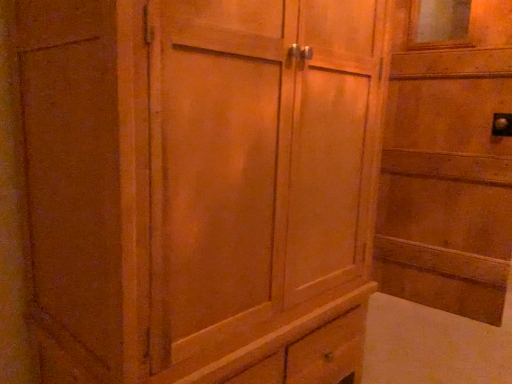
Question: Are wooden cabinet at center and wooden door at right making contact?

Choices:
 (A) no
 (B) yes

Answer: (A)

Question: Is wooden cabinet at center positioned with its back to wooden door at right?

Choices:
 (A) yes
 (B) no

Answer: (B)

Question: Is wooden cabinet at center positioned in front of wooden door at right?

Choices:
 (A) yes
 (B) no

Answer: (A)

Question: Is wooden cabinet at center behind wooden door at right?

Choices:
 (A) no
 (B) yes

Answer: (A)

Question: Would you say wooden cabinet at center is outside wooden door at right?

Choices:
 (A) no
 (B) yes

Answer: (B)

Question: From a real-world perspective, is wooden cabinet at center under wooden door at right?

Choices:
 (A) yes
 (B) no

Answer: (A)

Question: From a real-world perspective, does wooden door at right sit lower than wooden cabinet at center?

Choices:
 (A) yes
 (B) no

Answer: (B)

Question: From a real-world perspective, is wooden door at right positioned over wooden cabinet at center based on gravity?

Choices:
 (A) yes
 (B) no

Answer: (A)

Question: From the image's perspective, is wooden door at right under wooden cabinet at center?

Choices:
 (A) no
 (B) yes

Answer: (A)

Question: From the image's perspective, is wooden door at right located above wooden cabinet at center?

Choices:
 (A) yes
 (B) no

Answer: (A)

Question: Considering the relative positions of wooden door at right and wooden cabinet at center in the image provided, is wooden door at right to the left of wooden cabinet at center from the viewer's perspective?

Choices:
 (A) no
 (B) yes

Answer: (A)

Question: Is the position of wooden door at right more distant than that of wooden cabinet at center?

Choices:
 (A) yes
 (B) no

Answer: (A)

Question: In terms of width, does wooden cabinet at center look wider or thinner when compared to wooden door at right?

Choices:
 (A) thin
 (B) wide

Answer: (B)